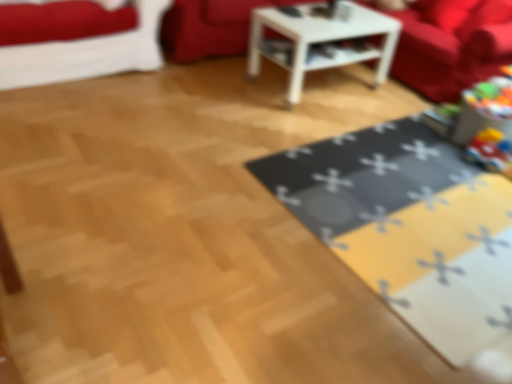
At what (x,y) coordinates should I click in order to perform the action: click on free space in front of white glossy table at center. Please return your answer as a coordinate pair (x, y). Looking at the image, I should click on (298, 120).